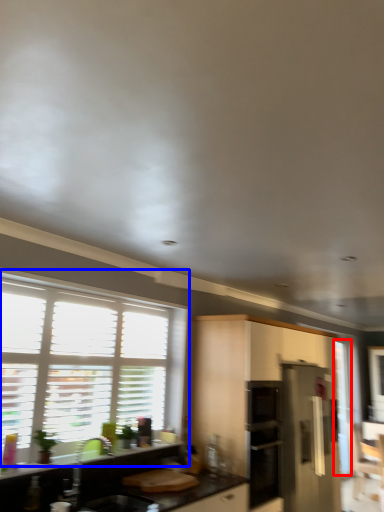
Question: Among these objects, which one is nearest to the camera, screen door (highlighted by a red box) or window (highlighted by a blue box)?

Choices:
 (A) screen door
 (B) window

Answer: (B)